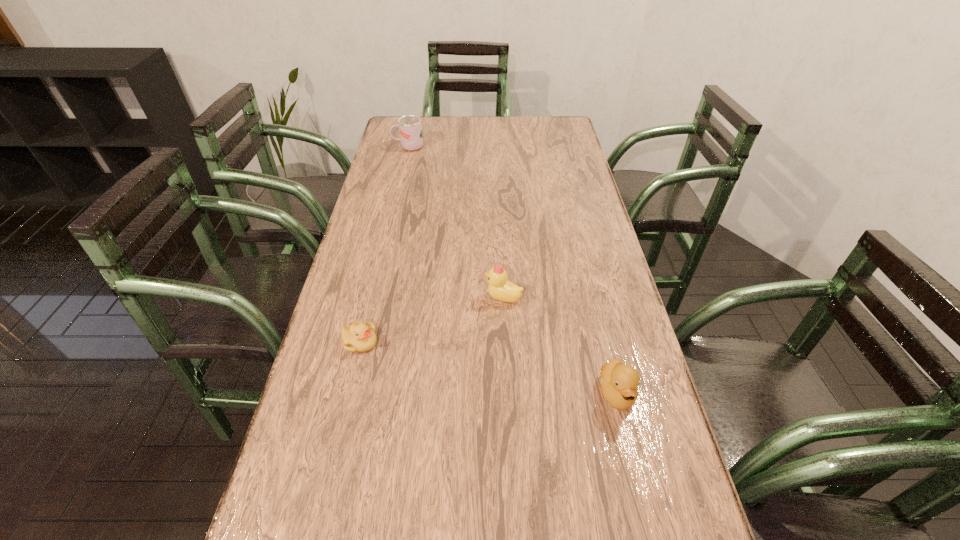
Where is `free space that is in between the farthest object and the nearest object`? The image size is (960, 540). free space that is in between the farthest object and the nearest object is located at coordinates (513, 270).

Find the location of `vacant space that's between the second duckling from left to right and the cup`. vacant space that's between the second duckling from left to right and the cup is located at coordinates (456, 222).

Image resolution: width=960 pixels, height=540 pixels. In order to click on free spot between the third object from left to right and the nearest duckling in this screenshot , I will do `click(560, 345)`.

Find the location of `object that ranks as the third closest to the third nearest object`. object that ranks as the third closest to the third nearest object is located at coordinates (410, 127).

Identify which object is the nearest to the shortest object. Please provide its 2D coordinates. Your answer should be formatted as a tuple, i.e. [(x, y)], where the tuple contains the x and y coordinates of a point satisfying the conditions above.

[(499, 288)]

The width and height of the screenshot is (960, 540). What are the coordinates of `duckling that is the second closest to the rightmost object` in the screenshot? It's located at pyautogui.click(x=359, y=337).

Select which duckling appears as the second closest to the third farthest object. Please provide its 2D coordinates. Your answer should be formatted as a tuple, i.e. [(x, y)], where the tuple contains the x and y coordinates of a point satisfying the conditions above.

[(619, 382)]